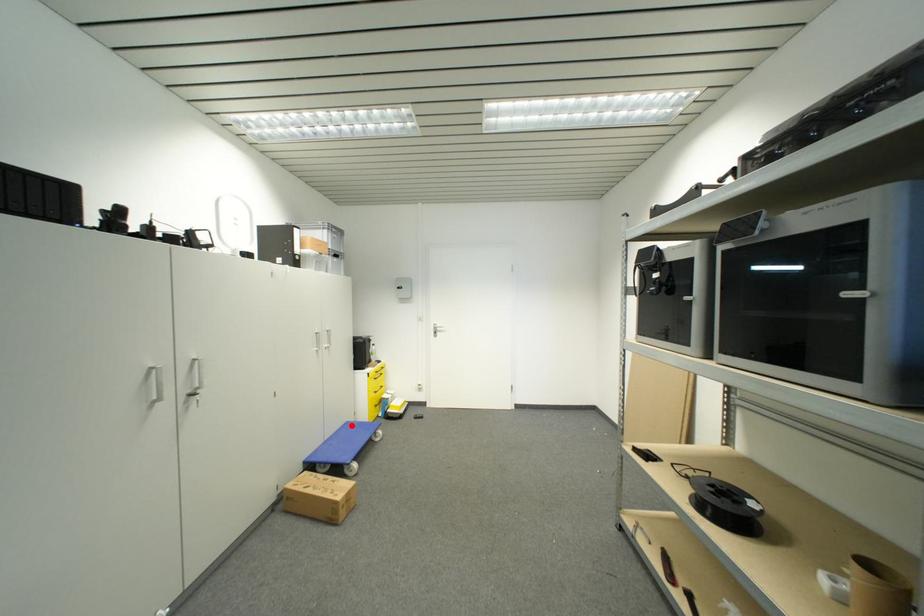
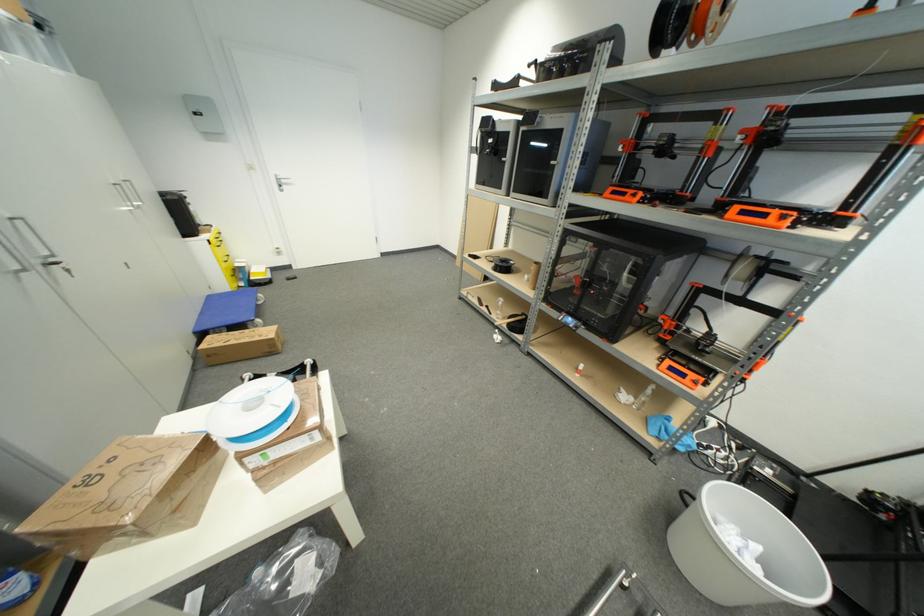
The point at the highlighted location is marked in the first image. Where is the corresponding point in the second image?

(213, 299)